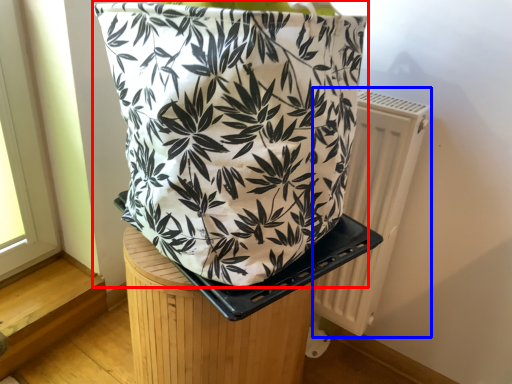
Question: Which object is closer to the camera taking this photo, handbag (highlighted by a red box) or radiator (highlighted by a blue box)?

Choices:
 (A) handbag
 (B) radiator

Answer: (A)